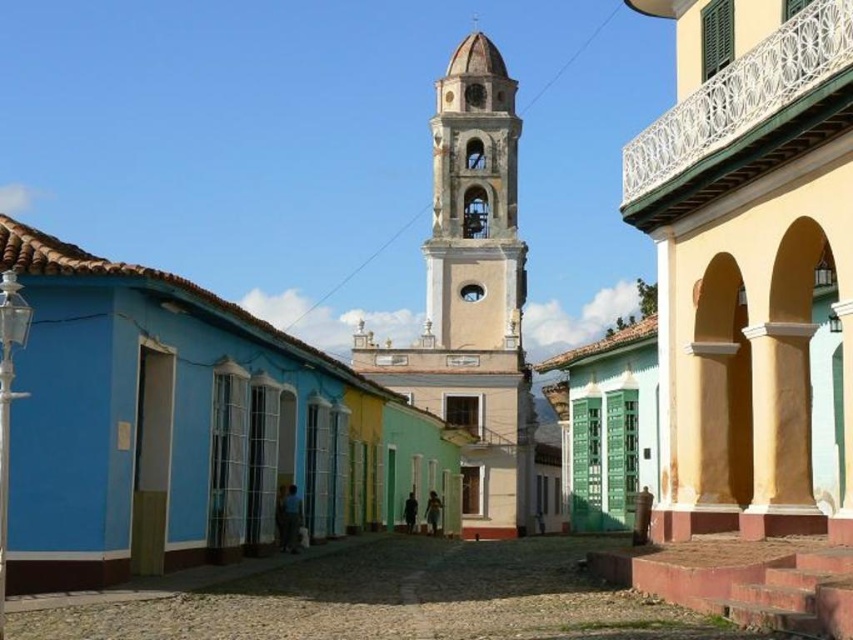
Question: Does light yellow stucco church at center appear over light beige stone bell tower at center?

Choices:
 (A) no
 (B) yes

Answer: (B)

Question: Is light yellow stucco church at center to the left of light beige stone bell tower at center from the viewer's perspective?

Choices:
 (A) yes
 (B) no

Answer: (A)

Question: Does light yellow stucco church at center have a smaller size compared to light beige stone bell tower at center?

Choices:
 (A) yes
 (B) no

Answer: (B)

Question: Which point is farther from the camera taking this photo?

Choices:
 (A) (425, 326)
 (B) (502, 177)

Answer: (B)

Question: Which point is closer to the camera?

Choices:
 (A) (529, 368)
 (B) (445, 68)

Answer: (A)